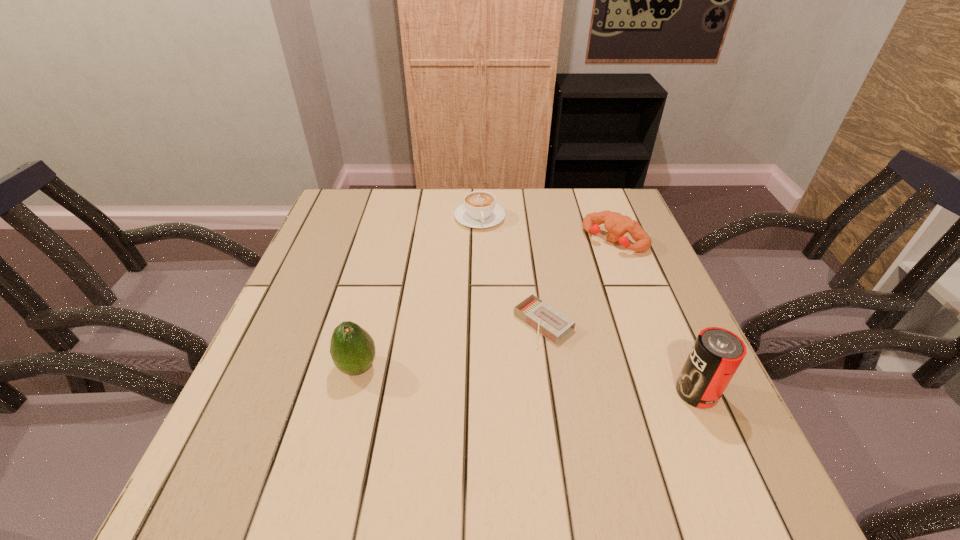
I want to click on free space between the third shortest object and the third object from left to right, so click(579, 282).

Find the location of a particular element. This screenshot has height=540, width=960. free space between the third tallest object and the second shortest object is located at coordinates (x=547, y=229).

Identify which object is the second nearest to the matchbox. Please provide its 2D coordinates. Your answer should be formatted as a tuple, i.e. [(x, y)], where the tuple contains the x and y coordinates of a point satisfying the conditions above.

[(617, 225)]

Where is `object that stands as the closest to the puncher`? This screenshot has height=540, width=960. object that stands as the closest to the puncher is located at coordinates (546, 320).

Identify the location of vacant position in the image that satisfies the following two spatial constraints: 1. on the back side of the avocado; 2. on the left side of the second shortest object. (396, 218).

I want to click on free spot that satisfies the following two spatial constraints: 1. on the front side of the puncher; 2. on the right side of the cappuccino, so click(x=480, y=240).

I want to click on free location that satisfies the following two spatial constraints: 1. on the front side of the fourth object from right to left; 2. on the right side of the can, so click(480, 392).

The image size is (960, 540). Find the location of `vacant area in the image that satisfies the following two spatial constraints: 1. on the front side of the second object from left to right; 2. on the right side of the third farthest object`. vacant area in the image that satisfies the following two spatial constraints: 1. on the front side of the second object from left to right; 2. on the right side of the third farthest object is located at coordinates (480, 325).